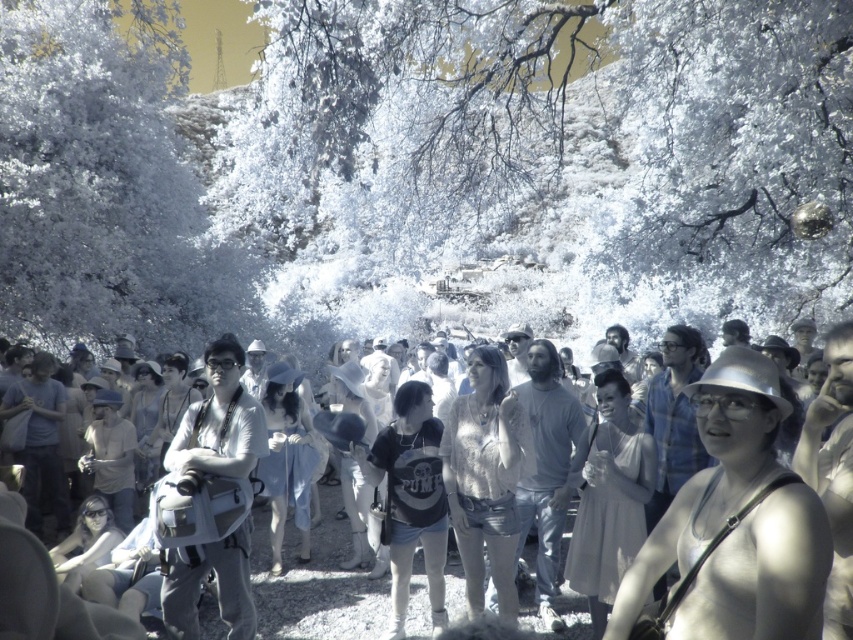
You are standing in the park scene and want to walk from point A to point B. Point A is at coordinate point(730, 522) and point B is at coordinate point(723, 616). Which direction should you move to get from point A to point B?

To move from point A to point B, you should move to the right since point B is located at a higher x coordinate than point A.

You are a photographer standing at the camera position. You want to capture a closeup shot of the matte gray backpack at center. Considering the distance, do you think you can reach it by walking forward without moving the camera tripod?

The matte gray backpack at center is 81.36 feet away from camera. Since 81.36 feet is approximately 24.8 meters, walking forward to reach it would require moving the tripod, so you cannot capture the closeup without moving the camera.

You are a photographer who wants to capture a photo of the matte white shirt at center and the metallic silver hat at center. Which object should you focus on first if you want to include both in your frame without moving the camera?

The matte white shirt at center is positioned on the left side of metallic silver hat at center, so you should focus on the matte white shirt at center first to ensure both objects are within the frame.